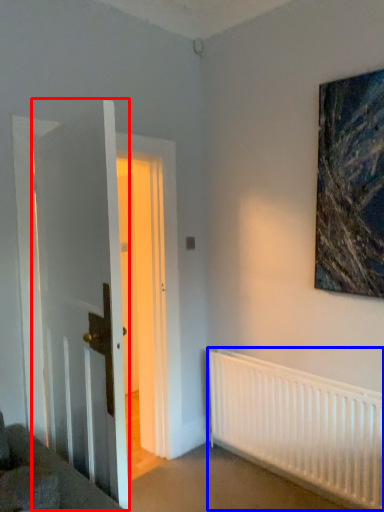
Question: Which object is further to the camera taking this photo, door (highlighted by a red box) or radiator (highlighted by a blue box)?

Choices:
 (A) door
 (B) radiator

Answer: (B)